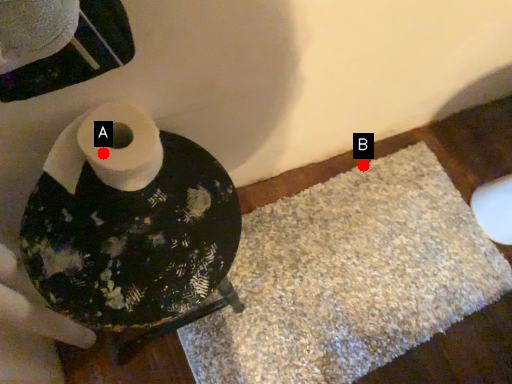
Question: Two points are circled on the image, labeled by A and B beside each circle. Which point is farther from the camera taking this photo?

Choices:
 (A) A is further
 (B) B is further

Answer: (B)